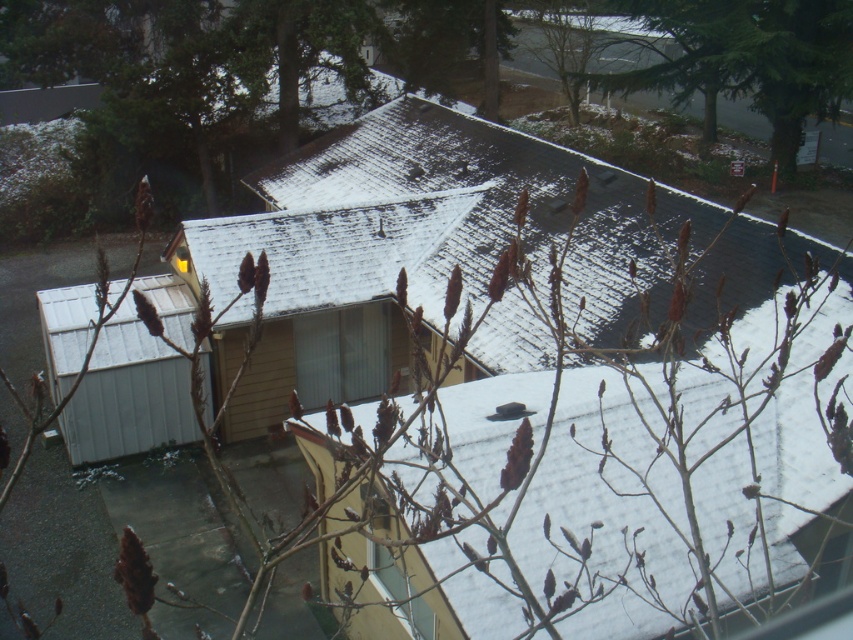
Question: Does green textured tree at upper right appear on the right side of metallic gray shed at left?

Choices:
 (A) yes
 (B) no

Answer: (A)

Question: Which of the following is the farthest from the observer?

Choices:
 (A) (387, 522)
 (B) (195, 429)
 (C) (459, 154)

Answer: (C)

Question: Can you confirm if green textured tree at upper right is positioned to the right of clear glass window at center?

Choices:
 (A) no
 (B) yes

Answer: (B)

Question: Which object is farther from the camera taking this photo?

Choices:
 (A) metallic gray shed at left
 (B) wooden cabin at center
 (C) clear glass window at center

Answer: (A)

Question: Which object is the closest to the clear glass window at center?

Choices:
 (A) wooden cabin at center
 (B) metallic gray shed at left
 (C) green textured tree at upper right

Answer: (B)

Question: Can you confirm if green textured tree at upper right is bigger than clear glass window at center?

Choices:
 (A) no
 (B) yes

Answer: (B)